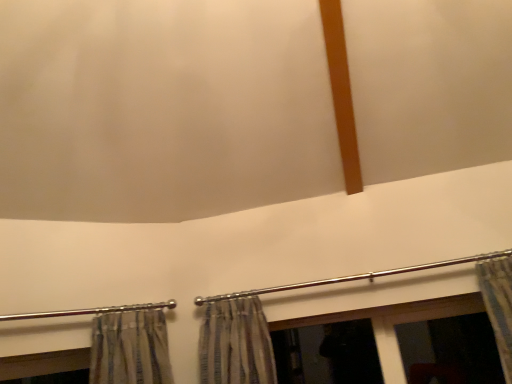
The height and width of the screenshot is (384, 512). What do you see at coordinates (353, 277) in the screenshot?
I see `polished metal rod at center, placed as the second clothesline when sorted from left to right` at bounding box center [353, 277].

Locate an element on the screen. This screenshot has width=512, height=384. polished metal rod at center, placed as the second clothesline when sorted from left to right is located at coordinates (353, 277).

Based on the photo, in order to face polished metal rod at center, marked as the first clothesline in a right-to-left arrangement, should I rotate leftwards or rightwards?

Rotate your view right by about 11.772°.

I want to click on polished metal rod at lower left, placed as the 2th clothesline when sorted from right to left, so click(x=90, y=311).

The width and height of the screenshot is (512, 384). Describe the element at coordinates (90, 311) in the screenshot. I see `polished metal rod at lower left, which is the first clothesline from left to right` at that location.

Locate an element on the screen. The height and width of the screenshot is (384, 512). polished metal rod at center, placed as the second clothesline when sorted from left to right is located at coordinates (353, 277).

Is polished metal rod at center, marked as the first clothesline in a right-to-left arrangement, to the left or to the right of polished metal rod at lower left, placed as the 2th clothesline when sorted from right to left, in the image?

polished metal rod at center, marked as the first clothesline in a right-to-left arrangement, is positioned on polished metal rod at lower left, placed as the 2th clothesline when sorted from right to left,'s right side.

Is polished metal rod at center, marked as the first clothesline in a right-to-left arrangement, further to the viewer compared to polished metal rod at lower left, which is the first clothesline from left to right?

Yes, polished metal rod at center, marked as the first clothesline in a right-to-left arrangement, is further from the camera.

Considering the positions of points (361, 276) and (112, 309), is point (361, 276) farther from camera compared to point (112, 309)?

Yes.

From the image's perspective, between polished metal rod at center, marked as the first clothesline in a right-to-left arrangement, and polished metal rod at lower left, placed as the 2th clothesline when sorted from right to left, who is located below?

polished metal rod at lower left, placed as the 2th clothesline when sorted from right to left, appears lower in the image.

From a real-world perspective, is polished metal rod at center, marked as the first clothesline in a right-to-left arrangement, over polished metal rod at lower left, placed as the 2th clothesline when sorted from right to left?

Yes.

Considering the sizes of objects polished metal rod at center, placed as the second clothesline when sorted from left to right, and polished metal rod at lower left, placed as the 2th clothesline when sorted from right to left, in the image provided, who is thinner, polished metal rod at center, placed as the second clothesline when sorted from left to right, or polished metal rod at lower left, placed as the 2th clothesline when sorted from right to left,?

polished metal rod at center, placed as the second clothesline when sorted from left to right, is thinner.

Which of these two, polished metal rod at center, marked as the first clothesline in a right-to-left arrangement, or polished metal rod at lower left, placed as the 2th clothesline when sorted from right to left, stands taller?

polished metal rod at lower left, placed as the 2th clothesline when sorted from right to left.

Considering the relative sizes of polished metal rod at center, placed as the second clothesline when sorted from left to right, and polished metal rod at lower left, which is the first clothesline from left to right, in the image provided, is polished metal rod at center, placed as the second clothesline when sorted from left to right, smaller than polished metal rod at lower left, which is the first clothesline from left to right,?

Yes, polished metal rod at center, placed as the second clothesline when sorted from left to right, is smaller than polished metal rod at lower left, which is the first clothesline from left to right.

Choose the correct answer: Is polished metal rod at center, placed as the second clothesline when sorted from left to right, inside polished metal rod at lower left, placed as the 2th clothesline when sorted from right to left, or outside it?

polished metal rod at center, placed as the second clothesline when sorted from left to right, is outside polished metal rod at lower left, placed as the 2th clothesline when sorted from right to left.

Would you say polished metal rod at center, marked as the first clothesline in a right-to-left arrangement, is a long distance from polished metal rod at lower left, which is the first clothesline from left to right?

No, there isn't a large distance between polished metal rod at center, marked as the first clothesline in a right-to-left arrangement, and polished metal rod at lower left, which is the first clothesline from left to right.

Is polished metal rod at center, marked as the first clothesline in a right-to-left arrangement, facing away from polished metal rod at lower left, placed as the 2th clothesline when sorted from right to left?

That's not correct — polished metal rod at center, marked as the first clothesline in a right-to-left arrangement, is not looking away from polished metal rod at lower left, placed as the 2th clothesline when sorted from right to left.

There is a polished metal rod at lower left, placed as the 2th clothesline when sorted from right to left. Where is `clothesline above it (from a real-world perspective)`? The image size is (512, 384). clothesline above it (from a real-world perspective) is located at coordinates pos(353,277).

Visually, is polished metal rod at lower left, placed as the 2th clothesline when sorted from right to left, positioned to the left or to the right of polished metal rod at center, placed as the second clothesline when sorted from left to right?

Clearly, polished metal rod at lower left, placed as the 2th clothesline when sorted from right to left, is on the left of polished metal rod at center, placed as the second clothesline when sorted from left to right, in the image.

Which is in front, polished metal rod at lower left, placed as the 2th clothesline when sorted from right to left, or polished metal rod at center, marked as the first clothesline in a right-to-left arrangement?

Positioned in front is polished metal rod at lower left, placed as the 2th clothesline when sorted from right to left.

Is point (173, 300) less distant than point (466, 258)?

That is False.

From the image's perspective, which one is positioned lower, polished metal rod at lower left, which is the first clothesline from left to right, or polished metal rod at center, marked as the first clothesline in a right-to-left arrangement?

polished metal rod at lower left, which is the first clothesline from left to right, from the image's perspective.

From a real-world perspective, which is physically below, polished metal rod at lower left, which is the first clothesline from left to right, or polished metal rod at center, marked as the first clothesline in a right-to-left arrangement?

polished metal rod at lower left, which is the first clothesline from left to right, from a real-world perspective.

Considering the sizes of polished metal rod at lower left, which is the first clothesline from left to right, and polished metal rod at center, marked as the first clothesline in a right-to-left arrangement, in the image, is polished metal rod at lower left, which is the first clothesline from left to right, wider or thinner than polished metal rod at center, marked as the first clothesline in a right-to-left arrangement,?

In the image, polished metal rod at lower left, which is the first clothesline from left to right, appears to be wider than polished metal rod at center, marked as the first clothesline in a right-to-left arrangement.

Which of these two, polished metal rod at lower left, which is the first clothesline from left to right, or polished metal rod at center, placed as the second clothesline when sorted from left to right, stands taller?

polished metal rod at lower left, which is the first clothesline from left to right, is taller.

Which of these two, polished metal rod at lower left, which is the first clothesline from left to right, or polished metal rod at center, placed as the second clothesline when sorted from left to right, is bigger?

polished metal rod at lower left, which is the first clothesline from left to right.

Could polished metal rod at center, marked as the first clothesline in a right-to-left arrangement, be considered to be inside polished metal rod at lower left, placed as the 2th clothesline when sorted from right to left?

No, polished metal rod at center, marked as the first clothesline in a right-to-left arrangement, is located outside of polished metal rod at lower left, placed as the 2th clothesline when sorted from right to left.

Would you say polished metal rod at lower left, which is the first clothesline from left to right, is a long distance from polished metal rod at center, placed as the second clothesline when sorted from left to right?

No, polished metal rod at lower left, which is the first clothesline from left to right, is not far from polished metal rod at center, placed as the second clothesline when sorted from left to right.

Is polished metal rod at lower left, which is the first clothesline from left to right, facing towards polished metal rod at center, placed as the second clothesline when sorted from left to right?

No.

Where is `clothesline below the polished metal rod at center, placed as the second clothesline when sorted from left to right (from the image's perspective)`? clothesline below the polished metal rod at center, placed as the second clothesline when sorted from left to right (from the image's perspective) is located at coordinates (90, 311).

Locate an element on the screen. clothesline located above the polished metal rod at lower left, placed as the 2th clothesline when sorted from right to left (from a real-world perspective) is located at coordinates click(x=353, y=277).

Where is `clothesline that is behind the polished metal rod at lower left, placed as the 2th clothesline when sorted from right to left`? The width and height of the screenshot is (512, 384). clothesline that is behind the polished metal rod at lower left, placed as the 2th clothesline when sorted from right to left is located at coordinates (353, 277).